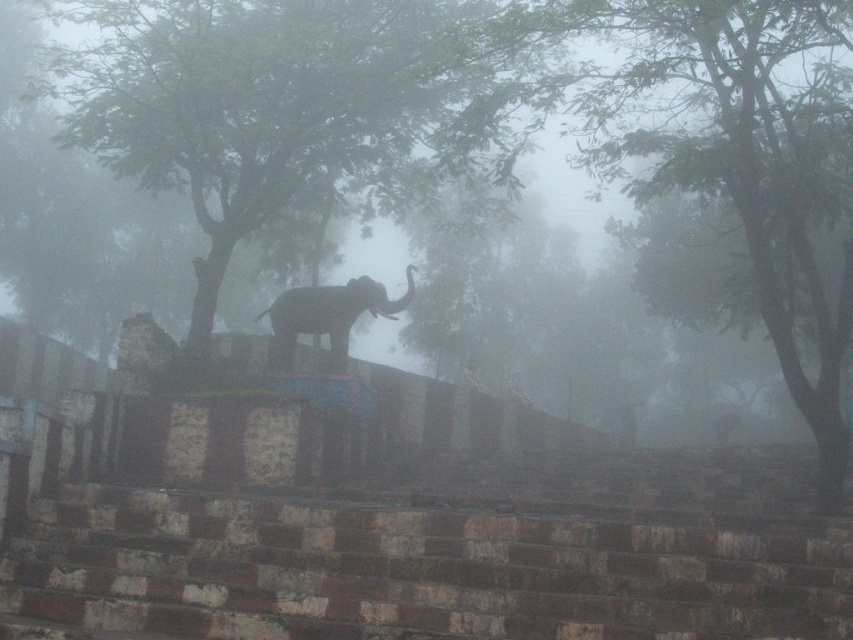
You are standing in the misty area and want to reach the point marked at coordinates (199,141). Given that the statue of the elephant is between you and that point, can you estimate how far the statue of the elephant is from you?

The point marked at coordinates (199,141) is 66.57 feet away from you. Since the statue of the elephant is between you and that point, the statue must be closer than 66.57 feet from you.

You are standing in the misty area and want to walk towards both the green leafy tree at center and the green leafy tree at upper center. Which tree will you reach first?

You will reach the green leafy tree at center first because it is closer to you than the green leafy tree at upper center, which is further away.

You are standing at the base of the stone steps leading up to the elephant statue. You notice a point marked at coordinates (695, 145) on your map. What does this point represent in the scene?

The point at (695, 145) indicates the location of the green leafy tree at upper center.